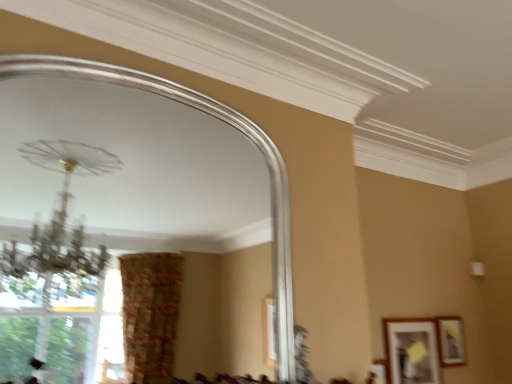
Question: From a real-world perspective, is matte black picture frame at lower right, the 1th picture frame from the left, located higher than matte gold picture frame at lower right, placed as the 2th picture frame when sorted from left to right?

Choices:
 (A) yes
 (B) no

Answer: (B)

Question: Does matte black picture frame at lower right, which is counted as the second picture frame, starting from the right, have a lesser height compared to matte gold picture frame at lower right, the first picture frame from the right?

Choices:
 (A) no
 (B) yes

Answer: (A)

Question: Can we say matte black picture frame at lower right, which is counted as the second picture frame, starting from the right, lies outside matte gold picture frame at lower right, placed as the 2th picture frame when sorted from left to right?

Choices:
 (A) yes
 (B) no

Answer: (A)

Question: Can you confirm if matte black picture frame at lower right, which is counted as the second picture frame, starting from the right, is positioned to the left of matte gold picture frame at lower right, placed as the 2th picture frame when sorted from left to right?

Choices:
 (A) yes
 (B) no

Answer: (A)

Question: Can you confirm if matte black picture frame at lower right, which is counted as the second picture frame, starting from the right, is thinner than matte gold picture frame at lower right, placed as the 2th picture frame when sorted from left to right?

Choices:
 (A) yes
 (B) no

Answer: (A)

Question: Does matte black picture frame at lower right, the 1th picture frame from the left, have a greater width compared to matte gold picture frame at lower right, the first picture frame from the right?

Choices:
 (A) no
 (B) yes

Answer: (A)

Question: Is matte gold picture frame at lower right, placed as the 2th picture frame when sorted from left to right, further to the viewer compared to matte black picture frame at lower right, which is counted as the second picture frame, starting from the right?

Choices:
 (A) no
 (B) yes

Answer: (B)

Question: Does matte gold picture frame at lower right, the first picture frame from the right, have a greater width compared to matte black picture frame at lower right, which is counted as the second picture frame, starting from the right?

Choices:
 (A) yes
 (B) no

Answer: (A)

Question: From the image's perspective, would you say matte gold picture frame at lower right, the first picture frame from the right, is shown under matte black picture frame at lower right, which is counted as the second picture frame, starting from the right?

Choices:
 (A) no
 (B) yes

Answer: (A)

Question: Is matte gold picture frame at lower right, placed as the 2th picture frame when sorted from left to right, to the right of matte black picture frame at lower right, the 1th picture frame from the left, from the viewer's perspective?

Choices:
 (A) no
 (B) yes

Answer: (B)

Question: Is there a large distance between matte gold picture frame at lower right, placed as the 2th picture frame when sorted from left to right, and matte black picture frame at lower right, which is counted as the second picture frame, starting from the right?

Choices:
 (A) yes
 (B) no

Answer: (B)

Question: Considering the relative sizes of matte gold picture frame at lower right, the first picture frame from the right, and matte black picture frame at lower right, the 1th picture frame from the left, in the image provided, is matte gold picture frame at lower right, the first picture frame from the right, bigger than matte black picture frame at lower right, the 1th picture frame from the left,?

Choices:
 (A) yes
 (B) no

Answer: (B)

Question: From the image's perspective, is silver metallic mirror at upper center on matte black picture frame at lower right, the 1th picture frame from the left?

Choices:
 (A) no
 (B) yes

Answer: (B)